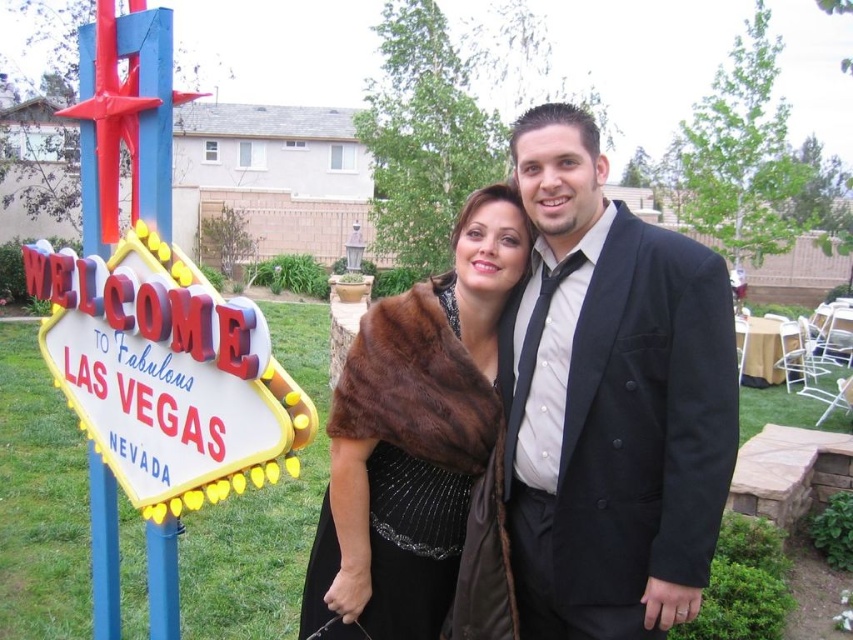
Question: Among these points, which one is nearest to the camera?

Choices:
 (A) (184, 278)
 (B) (439, 412)

Answer: (A)

Question: Among these points, which one is nearest to the camera?

Choices:
 (A) (251, 305)
 (B) (370, 529)

Answer: (A)

Question: Does black satin suit at center come in front of brown fur shawl at center?

Choices:
 (A) yes
 (B) no

Answer: (A)

Question: Is black satin suit at center positioned at the back of brown fur shawl at center?

Choices:
 (A) no
 (B) yes

Answer: (A)

Question: Which of the following is the farthest from the observer?

Choices:
 (A) black satin suit at center
 (B) brown fur shawl at center

Answer: (B)

Question: Is black satin suit at center smaller than neon sign at left?

Choices:
 (A) no
 (B) yes

Answer: (B)